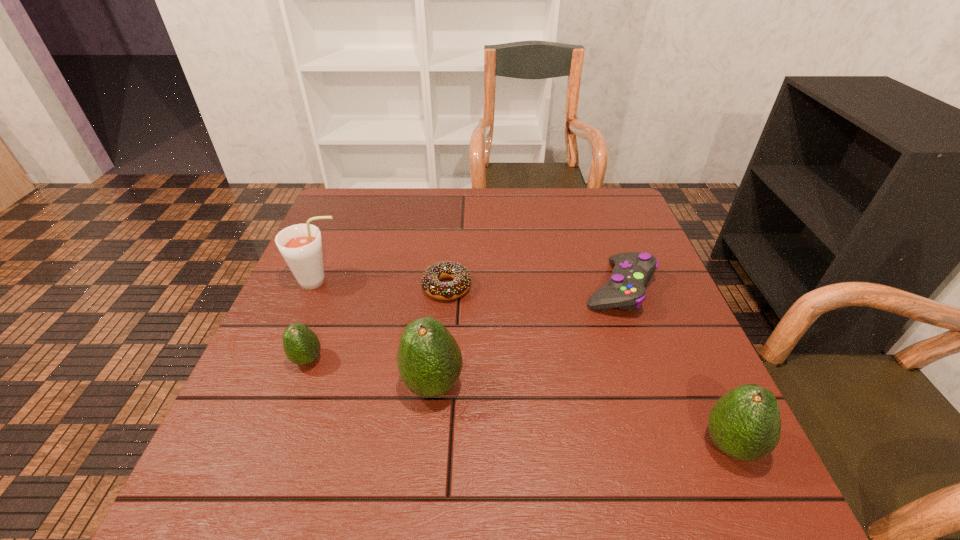
Please mark a free spot for a new avocado to balance the arrangement. Please provide its 2D coordinates. Your answer should be formatted as a tuple, i.e. [(x, y)], where the tuple contains the x and y coordinates of a point satisfying the conditions above.

[(573, 414)]